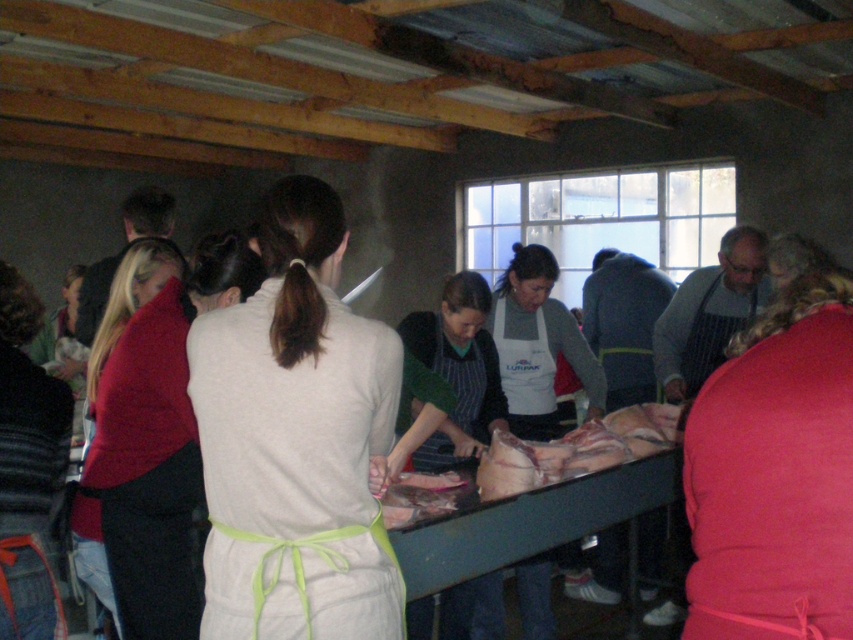
You are a guest at this event and want to sit down at the green plastic table at center. However, there is a white apron at center in your way. To reach the table, should you move around the apron on the left or the right side?

The green plastic table at center is to the left of the white apron at center, so you should move around the apron on the right side to reach the table.